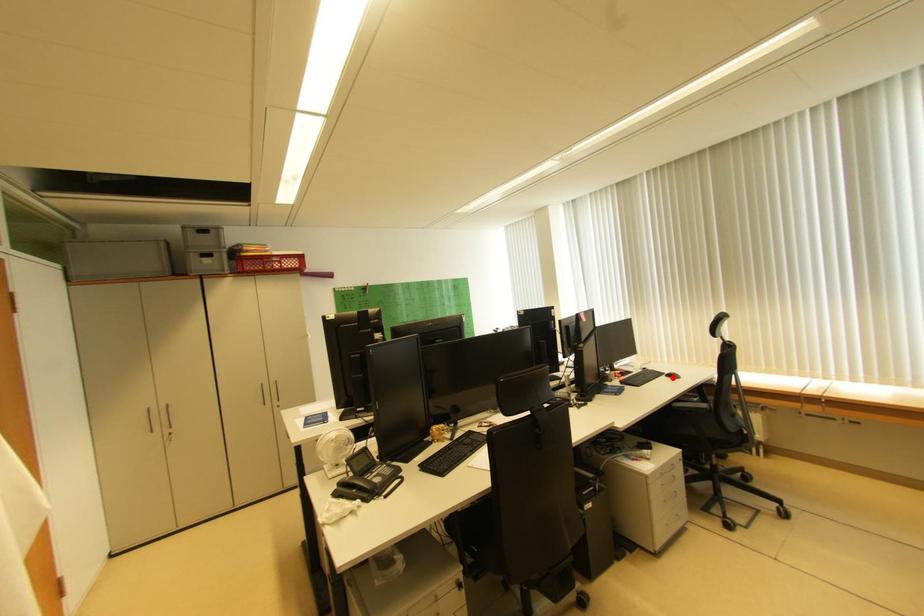
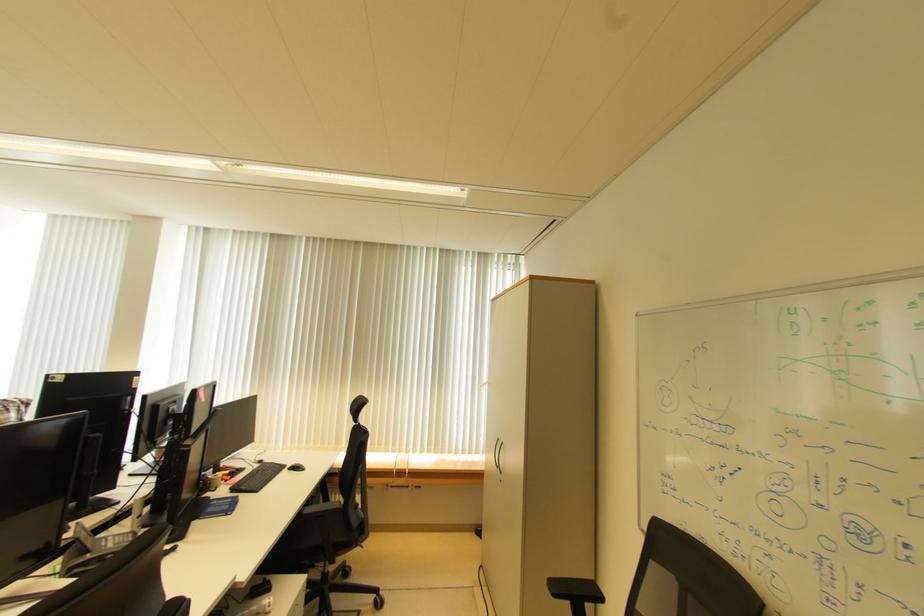
Find the pixel in the second image that matches the highlighted location in the first image.

(295, 471)